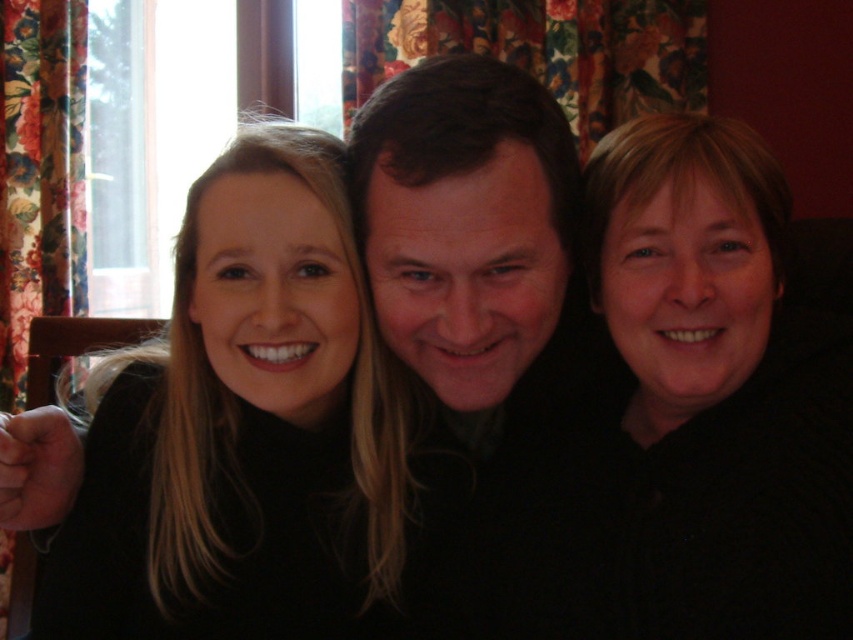
Which is more to the left, smooth black hair at center or black matte hair at upper right?

smooth black hair at center

Describe the element at coordinates (248, 429) in the screenshot. The image size is (853, 640). I see `smooth black hair at center` at that location.

I want to click on smooth black hair at center, so point(248,429).

Can you confirm if smooth black hair at center is positioned below smooth skin face at center?

Correct, smooth black hair at center is located below smooth skin face at center.

Who is more distant from viewer, (293, 545) or (541, 301)?

The point (293, 545) is more distant.

I want to click on smooth black hair at center, so pos(248,429).

Can you confirm if black matte hair at upper right is positioned below smooth skin face at center?

Yes.

Which is more to the right, black matte hair at upper right or smooth skin face at center?

Positioned to the right is black matte hair at upper right.

The width and height of the screenshot is (853, 640). What do you see at coordinates (717, 392) in the screenshot? I see `black matte hair at upper right` at bounding box center [717, 392].

Find the location of `black matte hair at upper right`. black matte hair at upper right is located at coordinates (717, 392).